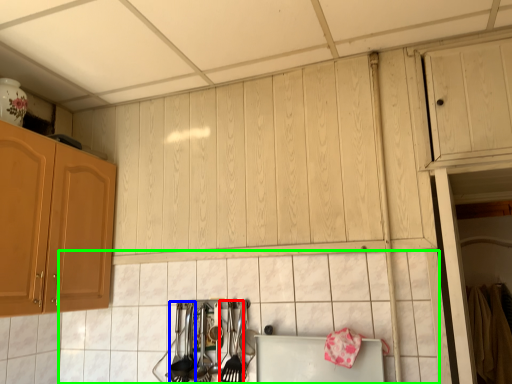
Question: Which object is positioned closest to silverware (highlighted by a red box)? Select from silverware (highlighted by a blue box) and tile (highlighted by a green box).

Choices:
 (A) silverware
 (B) tile

Answer: (A)